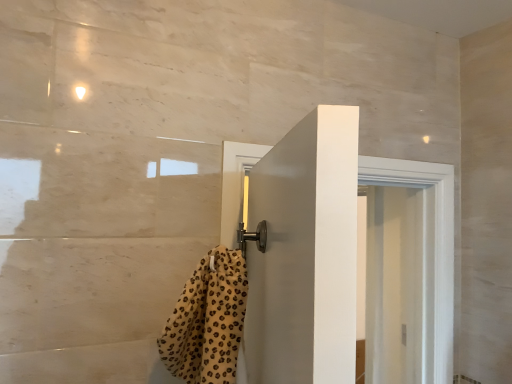
The height and width of the screenshot is (384, 512). What are the coordinates of `leopard print fabric towel at lower left` in the screenshot? It's located at (208, 321).

What do you see at coordinates (208, 321) in the screenshot?
I see `leopard print fabric towel at lower left` at bounding box center [208, 321].

The height and width of the screenshot is (384, 512). I want to click on leopard print fabric towel at lower left, so click(x=208, y=321).